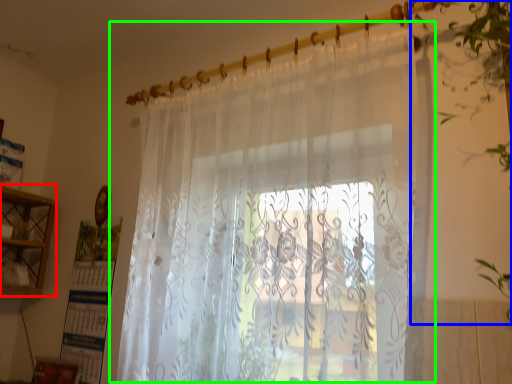
Question: Estimate the real-world distances between objects in this image. Which object is closer to cabinet (highlighted by a red box), vegetation (highlighted by a blue box) or curtain (highlighted by a green box)?

Choices:
 (A) vegetation
 (B) curtain

Answer: (B)